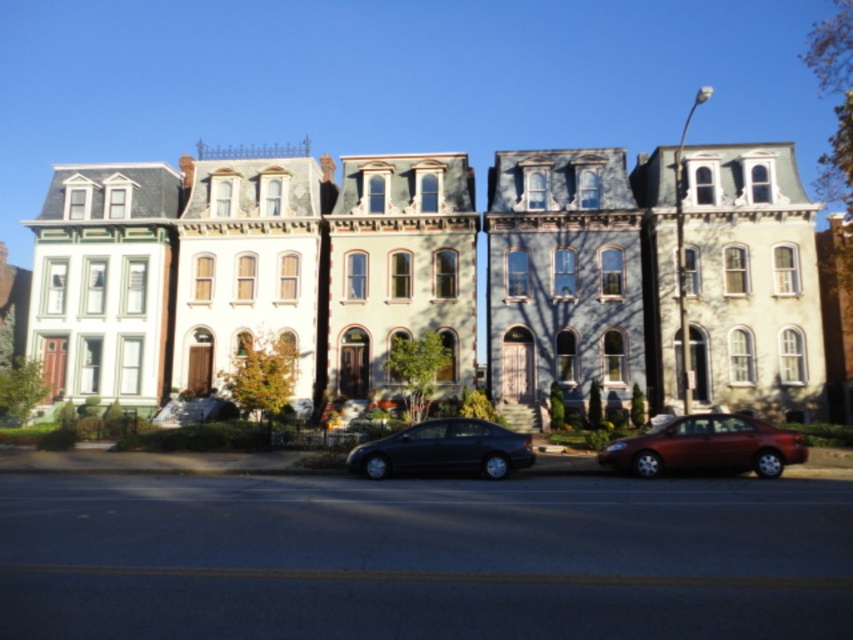
Question: Among these objects, which one is nearest to the camera?

Choices:
 (A) shiny red sedan at lower right
 (B) satin black sedan at center

Answer: (A)

Question: Is shiny red sedan at lower right to the right of satin black sedan at center from the viewer's perspective?

Choices:
 (A) yes
 (B) no

Answer: (A)

Question: Can you confirm if shiny red sedan at lower right is bigger than satin black sedan at center?

Choices:
 (A) no
 (B) yes

Answer: (B)

Question: Is shiny red sedan at lower right thinner than satin black sedan at center?

Choices:
 (A) no
 (B) yes

Answer: (A)

Question: Which object appears farthest from the camera in this image?

Choices:
 (A) shiny red sedan at lower right
 (B) satin black sedan at center

Answer: (B)

Question: Among these points, which one is farthest from the camera?

Choices:
 (A) (665, 465)
 (B) (503, 452)

Answer: (B)